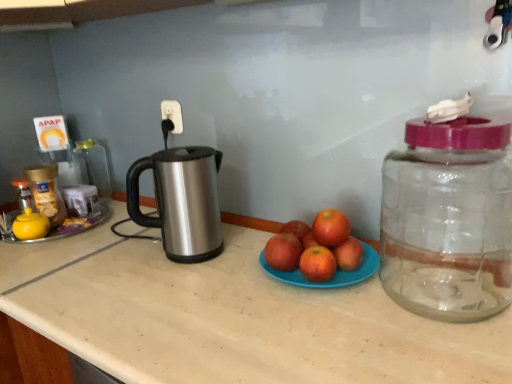
Where is `free spot in front of satin silver kettle at left`? The height and width of the screenshot is (384, 512). free spot in front of satin silver kettle at left is located at coordinates (179, 287).